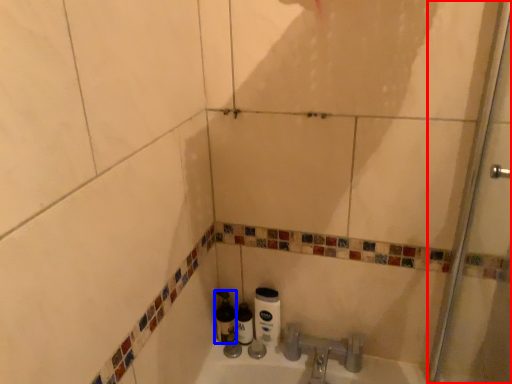
Question: Which point is further to the camera, shower door (highlighted by a red box) or bottle (highlighted by a blue box)?

Choices:
 (A) shower door
 (B) bottle

Answer: (B)